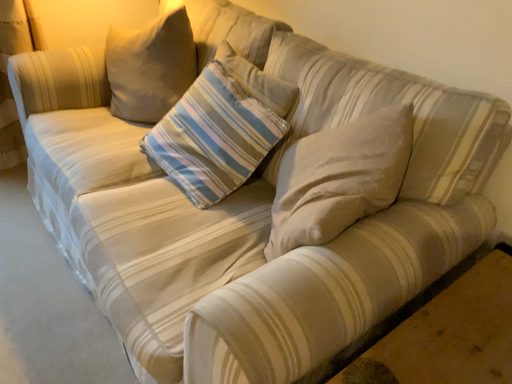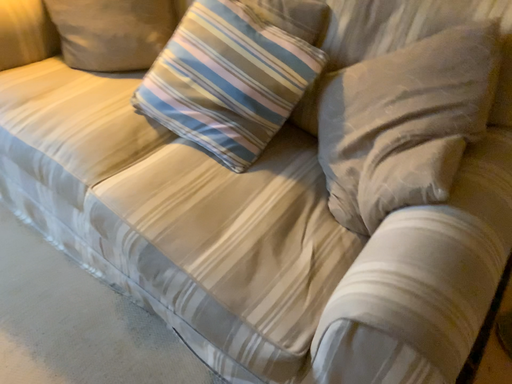
Question: How did the camera likely rotate when shooting the video?

Choices:
 (A) rotated downward
 (B) rotated upward

Answer: (A)